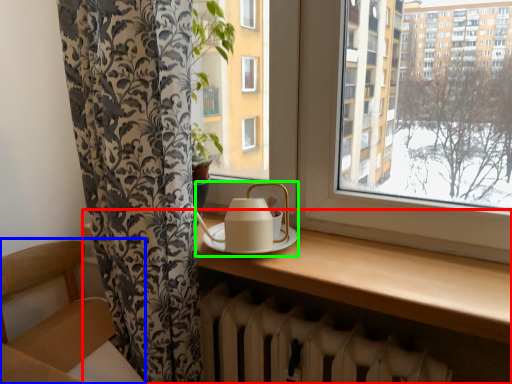
Question: Considering the real-world distances, which object is closest to table (highlighted by a red box)? armchair (highlighted by a blue box) or tea set (highlighted by a green box).

Choices:
 (A) armchair
 (B) tea set

Answer: (B)